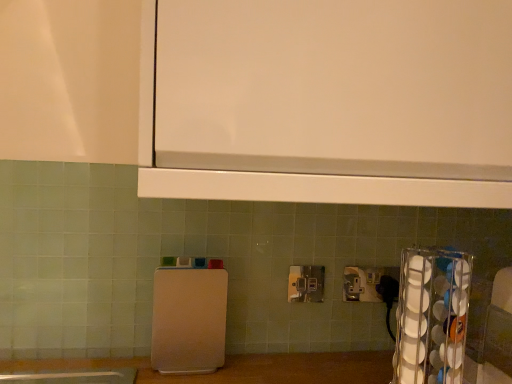
Question: Is clear plastic cup holder at right, positioned as the second appliance in left-to-right order, facing away from white plastic cutting board at center, marked as the second appliance in a front-to-back arrangement?

Choices:
 (A) no
 (B) yes

Answer: (A)

Question: From the image's perspective, is clear plastic cup holder at right, which ranks as the first appliance in front-to-back order, on white plastic cutting board at center, the 2th appliance viewed from the right?

Choices:
 (A) no
 (B) yes

Answer: (A)

Question: Can you confirm if clear plastic cup holder at right, which ranks as the first appliance in front-to-back order, is thinner than white plastic cutting board at center, the 2th appliance viewed from the right?

Choices:
 (A) no
 (B) yes

Answer: (A)

Question: Is clear plastic cup holder at right, arranged as the 1th appliance when viewed from the right, positioned behind white plastic cutting board at center, marked as the second appliance in a front-to-back arrangement?

Choices:
 (A) no
 (B) yes

Answer: (A)

Question: Are clear plastic cup holder at right, which ranks as the first appliance in front-to-back order, and white plastic cutting board at center, which is the first appliance from back to front, beside each other?

Choices:
 (A) yes
 (B) no

Answer: (B)

Question: From the image's perspective, is metallic silver power plugs and sockets at center positioned above or below clear plastic cup holder at right, which ranks as the first appliance in front-to-back order?

Choices:
 (A) above
 (B) below

Answer: (A)

Question: Considering the positions of metallic silver power plugs and sockets at center and clear plastic cup holder at right, which ranks as the first appliance in front-to-back order, in the image, is metallic silver power plugs and sockets at center wider or thinner than clear plastic cup holder at right, which ranks as the first appliance in front-to-back order,?

Choices:
 (A) thin
 (B) wide

Answer: (A)

Question: From a real-world perspective, is metallic silver power plugs and sockets at center positioned above or below clear plastic cup holder at right, positioned as the second appliance in left-to-right order?

Choices:
 (A) below
 (B) above

Answer: (B)

Question: Considering the positions of point (318, 286) and point (402, 296), is point (318, 286) closer or farther from the camera than point (402, 296)?

Choices:
 (A) closer
 (B) farther

Answer: (B)

Question: Considering the positions of clear plastic cup holder at right, arranged as the 1th appliance when viewed from the right, and metallic silver power plugs and sockets at center in the image, is clear plastic cup holder at right, arranged as the 1th appliance when viewed from the right, taller or shorter than metallic silver power plugs and sockets at center?

Choices:
 (A) short
 (B) tall

Answer: (B)

Question: Looking at their shapes, would you say clear plastic cup holder at right, acting as the second appliance starting from the back, is wider or thinner than metallic silver power plugs and sockets at center?

Choices:
 (A) thin
 (B) wide

Answer: (B)

Question: Would you say clear plastic cup holder at right, positioned as the second appliance in left-to-right order, is to the left or to the right of metallic silver power plugs and sockets at center in the picture?

Choices:
 (A) left
 (B) right

Answer: (B)

Question: From a real-world perspective, is clear plastic cup holder at right, arranged as the 1th appliance when viewed from the right, above or below metallic silver power plugs and sockets at center?

Choices:
 (A) above
 (B) below

Answer: (B)

Question: Does point (209, 314) appear closer or farther from the camera than point (415, 339)?

Choices:
 (A) farther
 (B) closer

Answer: (A)

Question: In the image, is white plastic cutting board at center, the 2th appliance viewed from the right, positioned in front of or behind clear plastic cup holder at right, acting as the second appliance starting from the back?

Choices:
 (A) front
 (B) behind

Answer: (B)